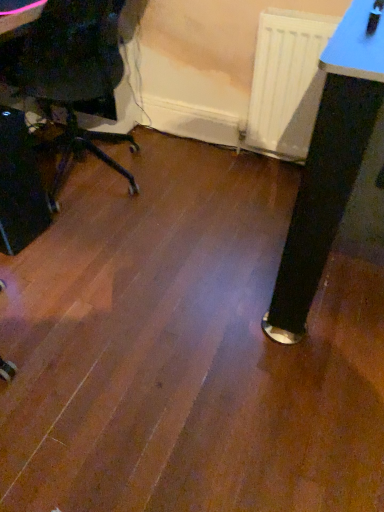
The width and height of the screenshot is (384, 512). Find the location of `free space in front of white matte radiator at center`. free space in front of white matte radiator at center is located at coordinates (272, 198).